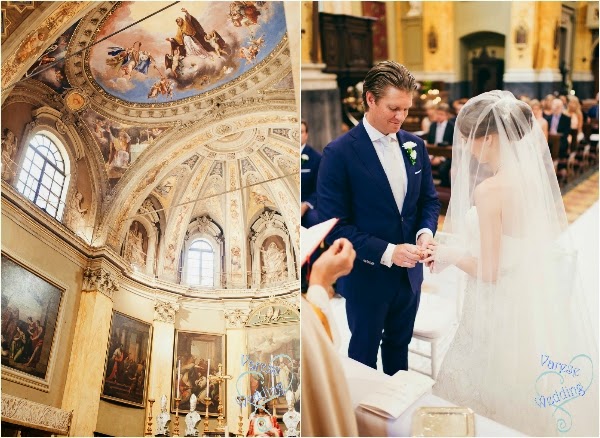
I want to click on candelabras, so click(x=150, y=417), click(x=176, y=420), click(x=205, y=418).